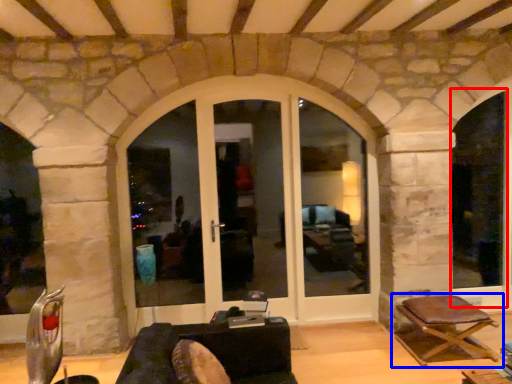
Question: Which object is further to the camera taking this photo, window frame (highlighted by a red box) or chair (highlighted by a blue box)?

Choices:
 (A) window frame
 (B) chair

Answer: (A)